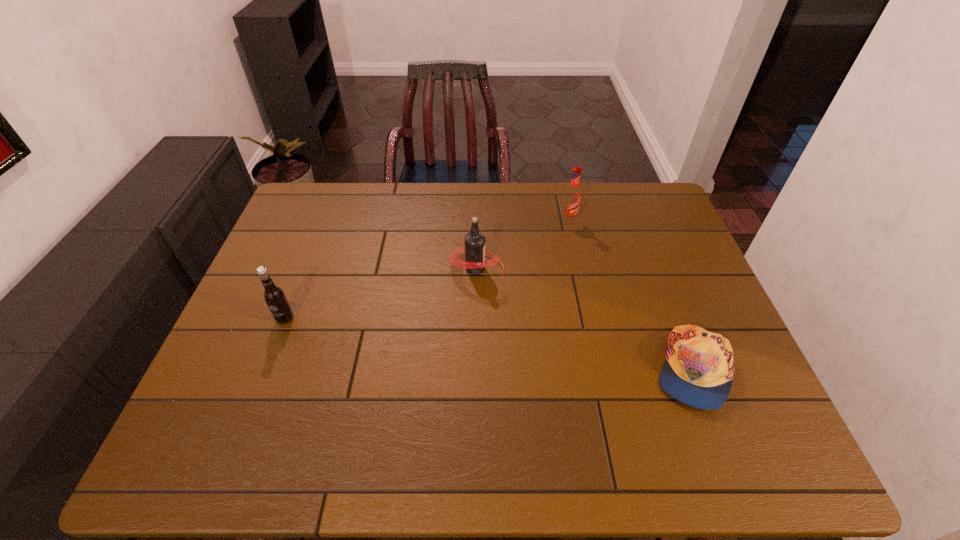
This screenshot has height=540, width=960. Identify the location of blank area located on the label of the second nearest object. (276, 341).

Find the location of a particular element. This screenshot has height=540, width=960. free spot located on the bill of the rightmost object is located at coordinates (727, 460).

The image size is (960, 540). Find the location of `object located at the far edge`. object located at the far edge is located at coordinates (571, 200).

Locate an element on the screen. The width and height of the screenshot is (960, 540). object at the left edge is located at coordinates (274, 296).

Locate an element on the screen. object located at the right edge is located at coordinates (699, 368).

The image size is (960, 540). In the image, there is a desktop. In order to click on free space at the far edge in this screenshot , I will do `click(562, 199)`.

Locate an element on the screen. The width and height of the screenshot is (960, 540). vacant space at the near edge of the desktop is located at coordinates (311, 456).

This screenshot has height=540, width=960. Find the location of `vacant space at the left edge`. vacant space at the left edge is located at coordinates (317, 264).

Identify the location of free space at the right edge of the desktop. The height and width of the screenshot is (540, 960). (678, 266).

Image resolution: width=960 pixels, height=540 pixels. I want to click on vacant position at the far left corner of the desktop, so click(x=300, y=206).